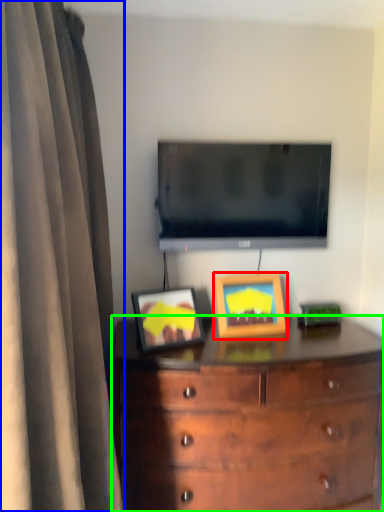
Question: Which is nearer to the picture frame (highlighted by a red box)? curtain (highlighted by a blue box) or chest of drawers (highlighted by a green box).

Choices:
 (A) curtain
 (B) chest of drawers

Answer: (B)